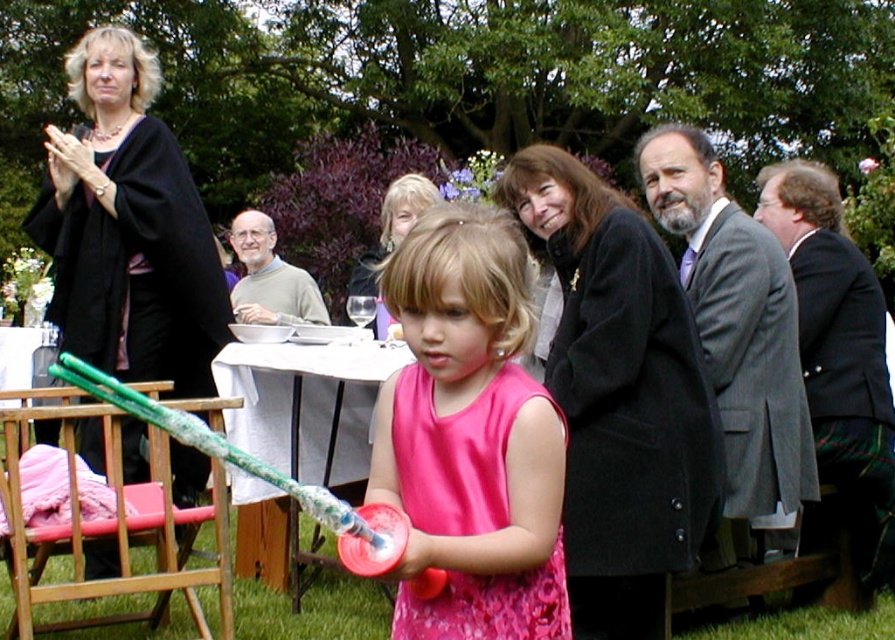
You are a photographer at the event and want to capture a photo that includes both the gray wool suit at upper right and the green plaid kilt at right. Given their distance, can you fit both into the frame without moving the camera?

The gray wool suit at upper right and green plaid kilt at right are 19.04 inches apart from each other. Since the distance between them is relatively small, it is likely possible to fit both into the camera frame without moving the camera position.

You are standing in the garden and see the green plaid kilt at right and the gray wool sweater at upper center. Which clothing item is nearer to you?

The green plaid kilt at right is closer to the viewer than the gray wool sweater at upper center.